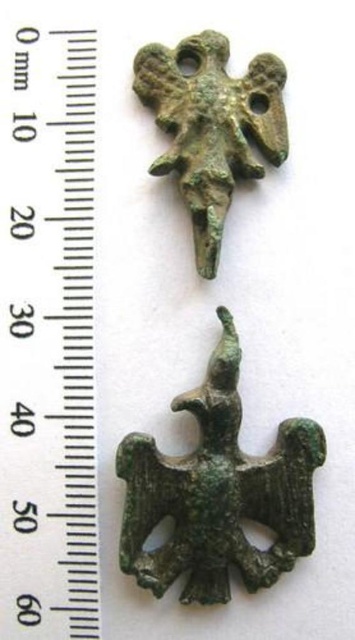
Does metallic ruler at upper left have a lesser height compared to green bronze eagle at upper center?

In fact, metallic ruler at upper left may be taller than green bronze eagle at upper center.

Between metallic ruler at upper left and green bronze eagle at upper center, which one is positioned lower?

metallic ruler at upper left is lower down.

Does point (44, 484) come closer to viewer compared to point (213, 138)?

No, (44, 484) is further to viewer.

You are a GUI agent. You are given a task and a screenshot of the screen. Output one action in this format:
    pyautogui.click(x=<x>, y=<y>)
    Task: Click on the metallic ruler at upper left
    
    Given the screenshot: What is the action you would take?
    pyautogui.click(x=47, y=333)

Is green patina metal eagle at center to the left of green bronze eagle at upper center from the viewer's perspective?

No, green patina metal eagle at center is not to the left of green bronze eagle at upper center.

Measure the distance between green patina metal eagle at center and camera.

A distance of 4.15 feet exists between green patina metal eagle at center and camera.

Image resolution: width=355 pixels, height=640 pixels. I want to click on green patina metal eagle at center, so click(217, 492).

Between metallic ruler at upper left and green patina metal eagle at center, which one appears on the right side from the viewer's perspective?

green patina metal eagle at center

Is point (6, 468) closer to viewer compared to point (206, 465)?

That is False.

Locate an element on the screen. The width and height of the screenshot is (355, 640). metallic ruler at upper left is located at coordinates pos(47,333).